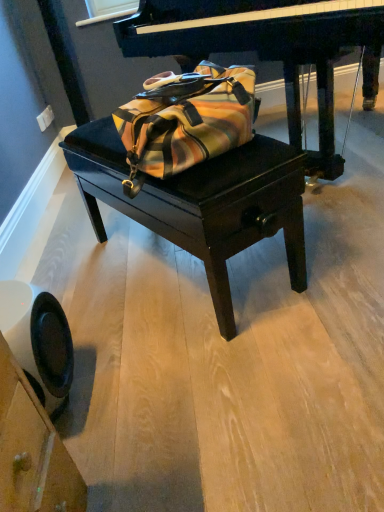
Where is `space that is in front of velvet black table at center`? space that is in front of velvet black table at center is located at coordinates (208, 374).